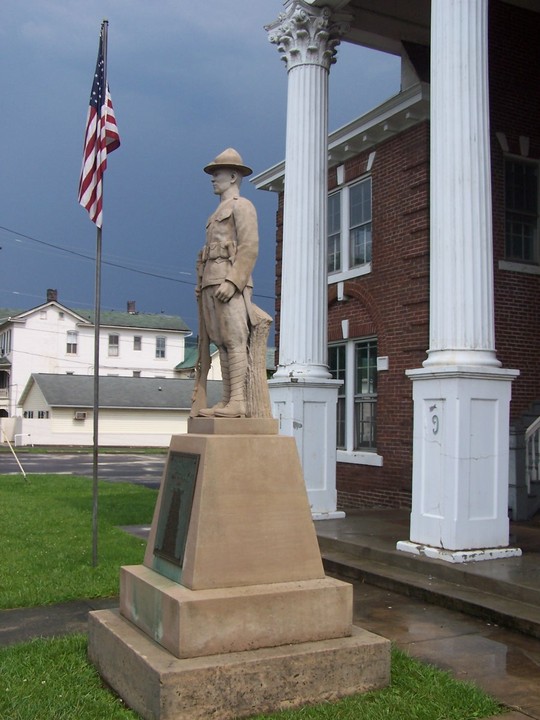
This screenshot has height=720, width=540. I want to click on statue, so click(226, 255).